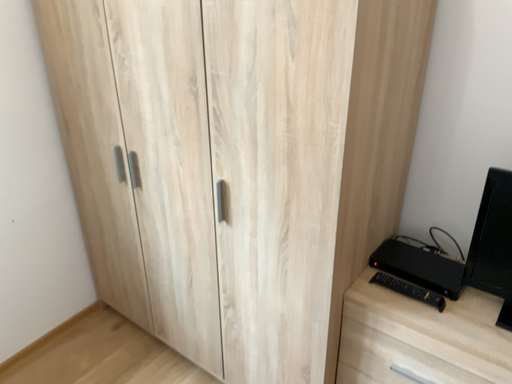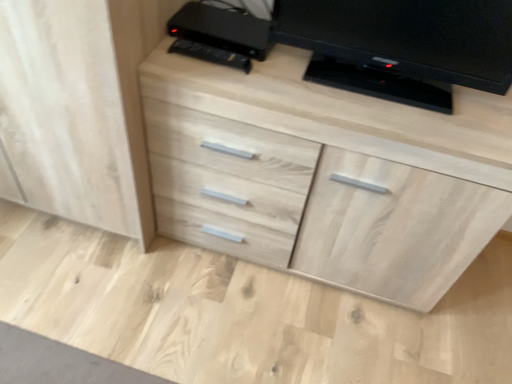
Question: Which way did the camera rotate in the video?

Choices:
 (A) rotated downward
 (B) rotated upward

Answer: (A)